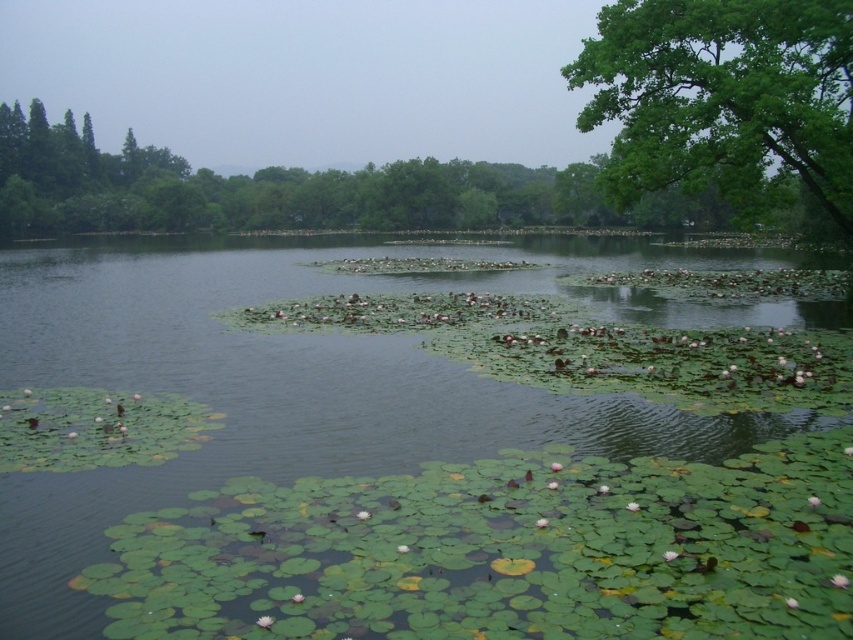
Based on the photo, you are standing at the edge of the water in the scene. There is a point marked at coordinates point [277,387]. What is the significance of this point in relation to the green leafy water at center?

The point [277,387] represents the location of the green leafy water at center.

What is the position of the green leafy water at center in the image?

The green leafy water at center is located at point (277,387).